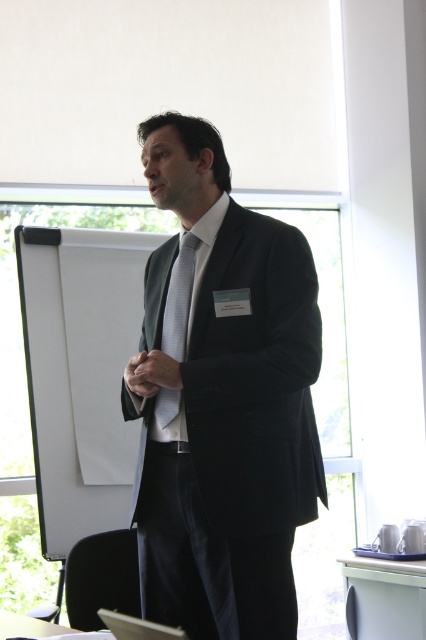
Does matte black suit at center have a greater height compared to silky gray tie at center?

Yes, matte black suit at center is taller than silky gray tie at center.

Does matte black suit at center have a larger size compared to silky gray tie at center?

Yes, matte black suit at center is bigger than silky gray tie at center.

Does point (247, 360) come farther from viewer compared to point (190, 230)?

No.

This screenshot has width=426, height=640. I want to click on matte black suit at center, so click(x=221, y=400).